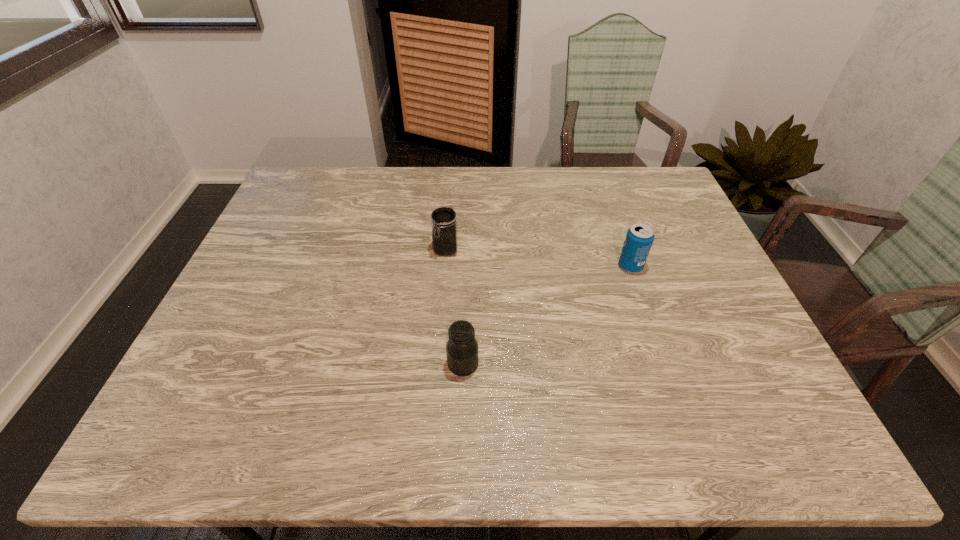
This screenshot has width=960, height=540. I want to click on free region that satisfies the following two spatial constraints: 1. on the lid of the farther jar; 2. on the left side of the nearer jar, so click(437, 364).